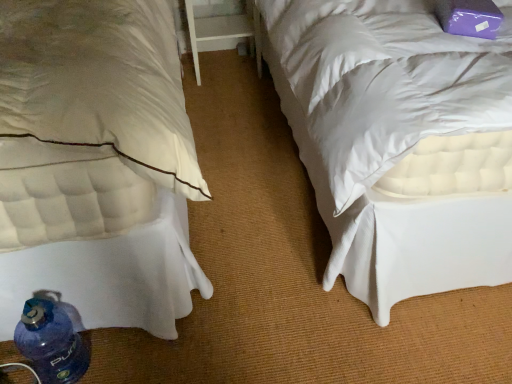
Question: From a real-world perspective, is white quilted mattress at lower left located beneath white wood table at center?

Choices:
 (A) no
 (B) yes

Answer: (A)

Question: Is white quilted mattress at lower left thinner than white wood table at center?

Choices:
 (A) no
 (B) yes

Answer: (A)

Question: From a real-world perspective, does white quilted mattress at lower left stand above white wood table at center?

Choices:
 (A) no
 (B) yes

Answer: (B)

Question: From the image's perspective, is white quilted mattress at lower left located above white wood table at center?

Choices:
 (A) yes
 (B) no

Answer: (B)

Question: Considering the relative positions of white quilted mattress at lower left and white wood table at center in the image provided, is white quilted mattress at lower left to the right of white wood table at center from the viewer's perspective?

Choices:
 (A) no
 (B) yes

Answer: (A)

Question: From the image's perspective, is blue plastic bottle at lower left located above or below white wood table at center?

Choices:
 (A) below
 (B) above

Answer: (A)

Question: Is blue plastic bottle at lower left bigger or smaller than white wood table at center?

Choices:
 (A) small
 (B) big

Answer: (A)

Question: Is point (76, 354) positioned closer to the camera than point (198, 28)?

Choices:
 (A) farther
 (B) closer

Answer: (B)

Question: Which is correct: blue plastic bottle at lower left is inside white wood table at center, or outside of it?

Choices:
 (A) outside
 (B) inside

Answer: (A)

Question: Visually, is white quilted mattress at lower left positioned to the left or to the right of blue plastic bottle at lower left?

Choices:
 (A) right
 (B) left

Answer: (B)

Question: Is white quilted mattress at lower left wider or thinner than blue plastic bottle at lower left?

Choices:
 (A) thin
 (B) wide

Answer: (B)

Question: Choose the correct answer: Is white quilted mattress at lower left inside blue plastic bottle at lower left or outside it?

Choices:
 (A) outside
 (B) inside

Answer: (A)

Question: Is point (91, 208) positioned closer to the camera than point (53, 324)?

Choices:
 (A) farther
 (B) closer

Answer: (B)

Question: Choose the correct answer: Is white wood table at center inside white quilted mattress at lower left or outside it?

Choices:
 (A) outside
 (B) inside

Answer: (A)

Question: Based on their positions, is white wood table at center located to the left or right of white quilted mattress at lower left?

Choices:
 (A) left
 (B) right

Answer: (B)